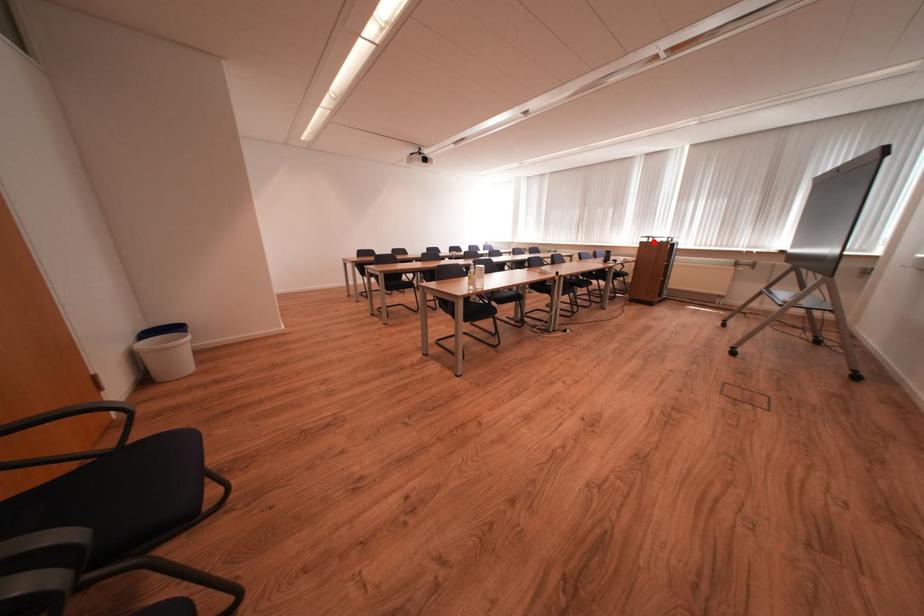
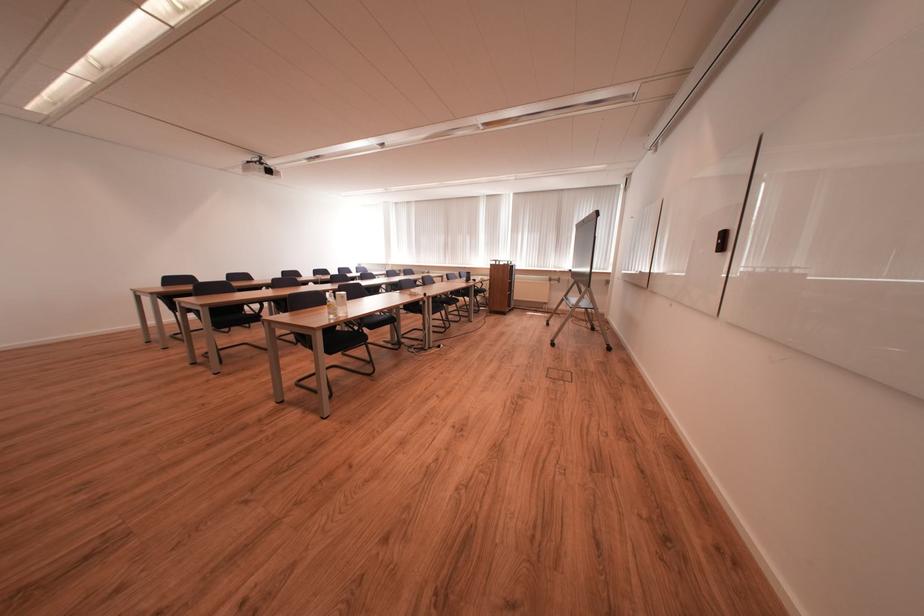
Question: I am providing you with two images of the same scene from different viewpoints. A red point is shown in image1. For the corresponding object point in image2, is it positioned nearer or farther from the camera?

Choices:
 (A) Nearer
 (B) Farther

Answer: (B)